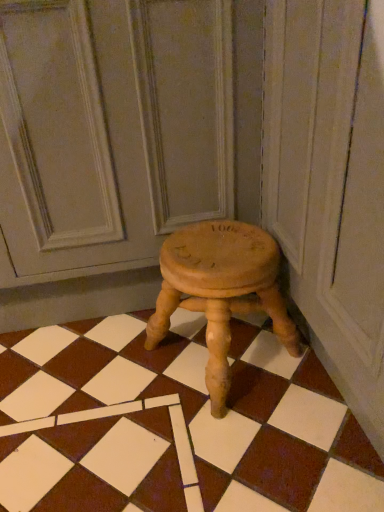
What do you see at coordinates (221, 291) in the screenshot? I see `wooden stool at center` at bounding box center [221, 291].

The height and width of the screenshot is (512, 384). I want to click on natural wood stool at center, so click(110, 130).

This screenshot has height=512, width=384. Describe the element at coordinates (110, 130) in the screenshot. I see `natural wood stool at center` at that location.

Where is `wooden stool at center`? The image size is (384, 512). wooden stool at center is located at coordinates (173, 425).

Between wooden stool at center and wooden stool at center, which one is positioned behind?

wooden stool at center.

Considering the sizes of objects wooden stool at center and wooden stool at center in the image provided, who is taller, wooden stool at center or wooden stool at center?

Standing taller between the two is wooden stool at center.

Which of these two, wooden stool at center or wooden stool at center, is wider?

With larger width is wooden stool at center.

Locate an element on the screen. This screenshot has height=512, width=384. screen door to the left of wooden stool at center is located at coordinates (110, 130).

From the image's perspective, is natural wood stool at center positioned above or below wooden stool at center?

Clearly, from the image's perspective, natural wood stool at center is above wooden stool at center.

Is natural wood stool at center at the left side of wooden stool at center?

Indeed, natural wood stool at center is positioned on the left side of wooden stool at center.

From a real-world perspective, which object rests below the other?

wooden stool at center.

Is wooden stool at center to the left or to the right of natural wood stool at center in the image?

From the image, it's evident that wooden stool at center is to the right of natural wood stool at center.

Find the location of a particular element. The height and width of the screenshot is (512, 384). square directly beneath the natural wood stool at center (from a real-world perspective) is located at coordinates (173, 425).

Could natural wood stool at center be considered to be inside wooden stool at center?

Definitely not — natural wood stool at center is not inside wooden stool at center.

Considering the relative sizes of wooden stool at center and natural wood stool at center in the image provided, is wooden stool at center shorter than natural wood stool at center?

Yes, wooden stool at center is shorter than natural wood stool at center.

From a real-world perspective, is wooden stool at center over natural wood stool at center?

No, from a real-world perspective, wooden stool at center is not on top of natural wood stool at center.

Is wooden stool at center inside or outside of natural wood stool at center?

wooden stool at center exists outside the volume of natural wood stool at center.

Find the location of a particular element. This screenshot has height=512, width=384. stool on the right of natural wood stool at center is located at coordinates (221, 291).

From the picture: How many degrees apart are the facing directions of wooden stool at center and natural wood stool at center?

The angular difference between wooden stool at center and natural wood stool at center is 1.14 degrees.

Considering the sizes of objects natural wood stool at center and wooden stool at center in the image provided, who is taller, natural wood stool at center or wooden stool at center?

natural wood stool at center is taller.

Considering the relative sizes of natural wood stool at center and wooden stool at center in the image provided, is natural wood stool at center thinner than wooden stool at center?

Indeed, natural wood stool at center has a lesser width compared to wooden stool at center.

Is point (186, 118) closer or farther from the camera than point (181, 462)?

Point (186, 118) is positioned farther from the camera compared to point (181, 462).

Would you say wooden stool at center is part of natural wood stool at center's contents?

No.

Is wooden stool at center behind wooden stool at center?

No.

From the image's perspective, is wooden stool at center above wooden stool at center?

Indeed, from the image's perspective, wooden stool at center is shown above wooden stool at center.

Considering the sizes of wooden stool at center and wooden stool at center in the image, is wooden stool at center wider or thinner than wooden stool at center?

wooden stool at center is wider than wooden stool at center.

Can we say wooden stool at center lies outside wooden stool at center?

wooden stool at center is positioned outside wooden stool at center.

At what (x,y) coordinates should I click in order to perform the action: click on stool behind the wooden stool at center. Please return your answer as a coordinate pair (x, y). The width and height of the screenshot is (384, 512). Looking at the image, I should click on (221, 291).

Locate an element on the screen. screen door located on the left of wooden stool at center is located at coordinates (110, 130).

Based on their spatial positions, is natural wood stool at center or wooden stool at center further from wooden stool at center?

The object further to wooden stool at center is natural wood stool at center.

From the picture: Estimate the real-world distances between objects in this image. Which object is further from natural wood stool at center, wooden stool at center or wooden stool at center?

Based on the image, wooden stool at center appears to be further to natural wood stool at center.

Based on their spatial positions, is wooden stool at center or natural wood stool at center further from wooden stool at center?

natural wood stool at center.

Estimate the real-world distances between objects in this image. Which object is further from natural wood stool at center, wooden stool at center or wooden stool at center?

wooden stool at center.

Looking at this image, estimate the real-world distances between objects in this image. Which object is further from wooden stool at center, natural wood stool at center or wooden stool at center?

Based on the image, natural wood stool at center appears to be further to wooden stool at center.

Which object lies nearer to the anchor point wooden stool at center, wooden stool at center or natural wood stool at center?

Among the two, wooden stool at center is located nearer to wooden stool at center.

In order to click on square between natural wood stool at center and wooden stool at center in the up-down direction in this screenshot , I will do `click(173, 425)`.